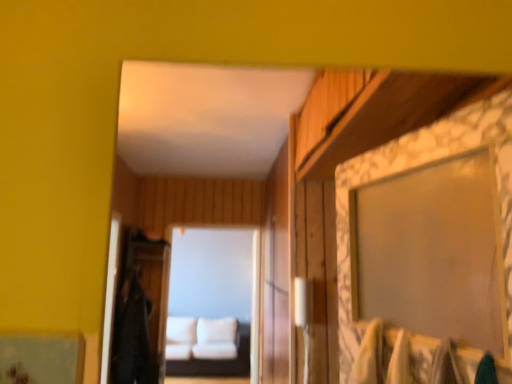
Question: Can you confirm if white fabric couch at center is positioned to the right of white fabric couch at center?

Choices:
 (A) no
 (B) yes

Answer: (B)

Question: Is white fabric couch at center inside white fabric couch at center?

Choices:
 (A) yes
 (B) no

Answer: (B)

Question: From a real-world perspective, is white fabric couch at center below white fabric couch at center?

Choices:
 (A) no
 (B) yes

Answer: (A)

Question: Is white fabric couch at center outside white fabric couch at center?

Choices:
 (A) no
 (B) yes

Answer: (B)

Question: Is white fabric couch at center behind white fabric couch at center?

Choices:
 (A) no
 (B) yes

Answer: (A)

Question: Is white fabric couch at center in front of or behind white fabric couch at center in the image?

Choices:
 (A) behind
 (B) front

Answer: (B)

Question: Does point (184, 294) appear closer or farther from the camera than point (224, 370)?

Choices:
 (A) closer
 (B) farther

Answer: (B)

Question: From the image's perspective, is white fabric couch at center located above or below white fabric couch at center?

Choices:
 (A) above
 (B) below

Answer: (A)

Question: From a real-world perspective, is white fabric couch at center positioned above or below white fabric couch at center?

Choices:
 (A) above
 (B) below

Answer: (A)

Question: Looking at the image, does black fabric robe at left seem bigger or smaller compared to white fabric couch at center?

Choices:
 (A) big
 (B) small

Answer: (B)

Question: Do you think black fabric robe at left is within white fabric couch at center, or outside of it?

Choices:
 (A) outside
 (B) inside

Answer: (A)

Question: Is black fabric robe at left taller or shorter than white fabric couch at center?

Choices:
 (A) tall
 (B) short

Answer: (B)

Question: Looking at their shapes, would you say black fabric robe at left is wider or thinner than white fabric couch at center?

Choices:
 (A) thin
 (B) wide

Answer: (B)

Question: From a real-world perspective, is white fabric couch at center positioned above or below black fabric robe at left?

Choices:
 (A) below
 (B) above

Answer: (A)

Question: Considering the relative positions of white fabric couch at center and black fabric robe at left in the image provided, is white fabric couch at center to the left or to the right of black fabric robe at left?

Choices:
 (A) left
 (B) right

Answer: (B)